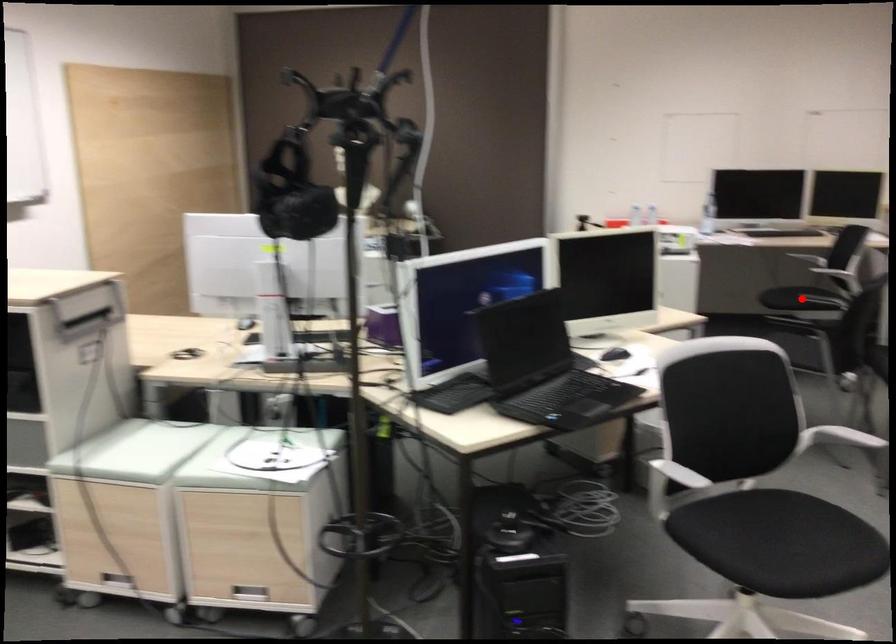
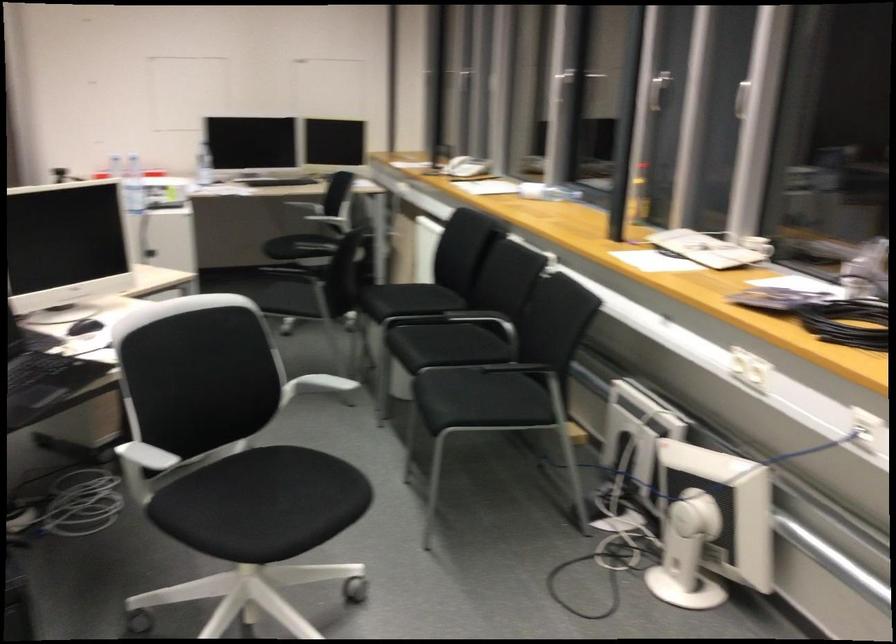
The point at the highlighted location is marked in the first image. Where is the corresponding point in the second image?

(287, 257)